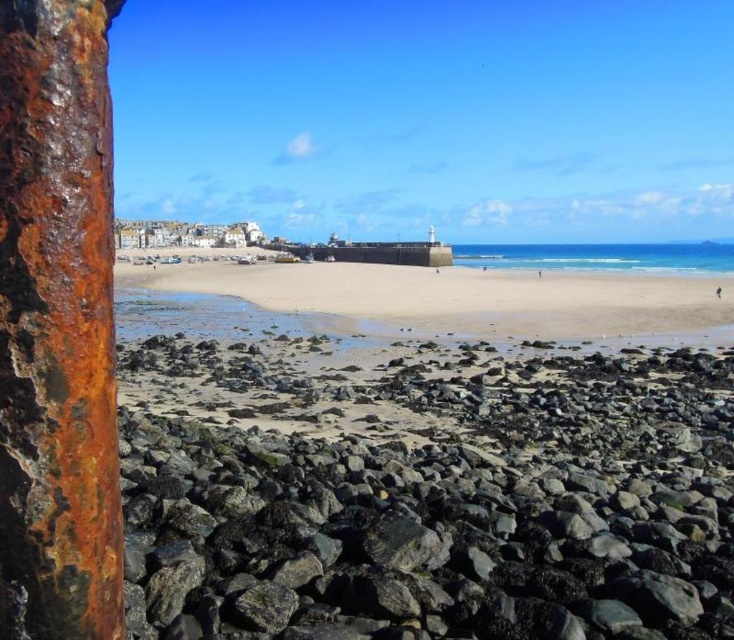
Question: Which of the following is the farthest from the observer?

Choices:
 (A) tap(330, 580)
 (B) tap(46, 592)
 (C) tap(230, 308)

Answer: (C)

Question: Can you confirm if rusty metal rocks at lower left is positioned above smooth sand at center?

Choices:
 (A) yes
 (B) no

Answer: (B)

Question: Can you confirm if rusty metal rocks at lower left is wider than rusty metal pole at left?

Choices:
 (A) no
 (B) yes

Answer: (B)

Question: Is rusty metal rocks at lower left positioned before blue glossy water at center?

Choices:
 (A) no
 (B) yes

Answer: (B)

Question: Which point is farther from the camera taking this photo?

Choices:
 (A) (655, 259)
 (B) (15, 604)
 (C) (490, 388)
 (D) (181, 268)

Answer: (A)

Question: Which point is farther to the camera?

Choices:
 (A) blue glossy water at center
 (B) rusty metal rocks at lower left

Answer: (A)